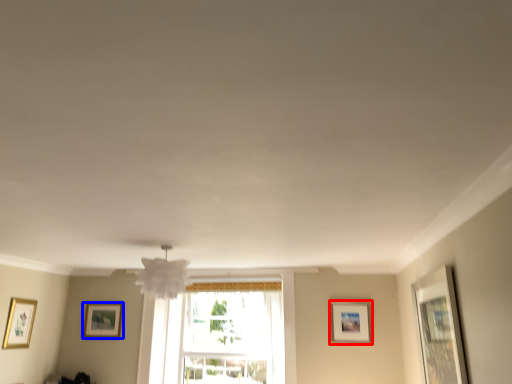
Question: Which of the following is the closest to the observer, picture frame (highlighted by a red box) or picture frame (highlighted by a blue box)?

Choices:
 (A) picture frame
 (B) picture frame

Answer: (A)